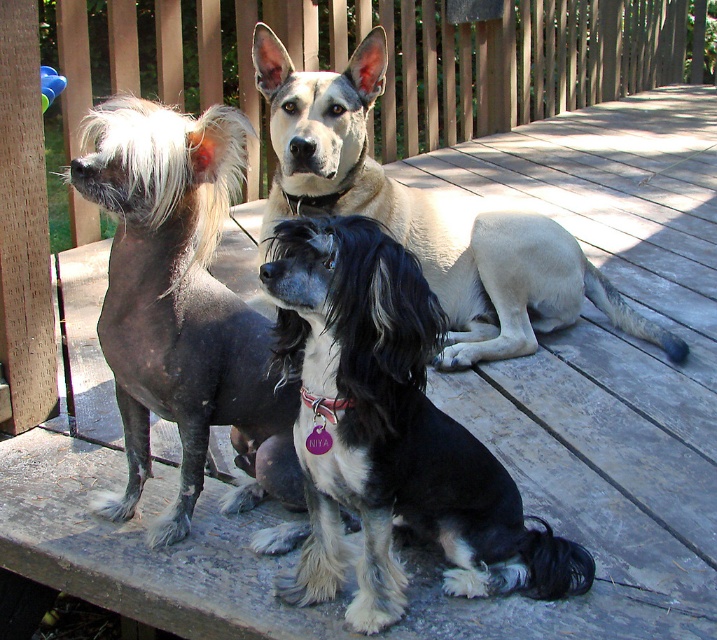
Can you confirm if shiny black fur at center is smaller than light beige fur at center?

Yes, shiny black fur at center is smaller than light beige fur at center.

In the scene shown: Can you confirm if shiny black fur at center is positioned above light beige fur at center?

Incorrect, shiny black fur at center is not positioned above light beige fur at center.

Which is behind, point (199, 445) or point (336, 86)?

Point (336, 86)

Locate an element on the screen. The image size is (717, 640). shiny black fur at center is located at coordinates click(x=179, y=301).

Consider the image. Is black silky dog at center to the right of light beige fur at center from the viewer's perspective?

In fact, black silky dog at center is to the left of light beige fur at center.

Is black silky dog at center smaller than light beige fur at center?

Indeed, black silky dog at center has a smaller size compared to light beige fur at center.

Identify the location of black silky dog at center. click(389, 433).

Does black silky dog at center appear under shiny black fur at center?

Indeed, black silky dog at center is positioned under shiny black fur at center.

Between black silky dog at center and shiny black fur at center, which one appears on the right side from the viewer's perspective?

From the viewer's perspective, black silky dog at center appears more on the right side.

You are a GUI agent. You are given a task and a screenshot of the screen. Output one action in this format:
    pyautogui.click(x=<x>, y=<y>)
    Task: Click on the black silky dog at center
    This screenshot has width=717, height=640.
    Given the screenshot: What is the action you would take?
    pyautogui.click(x=389, y=433)